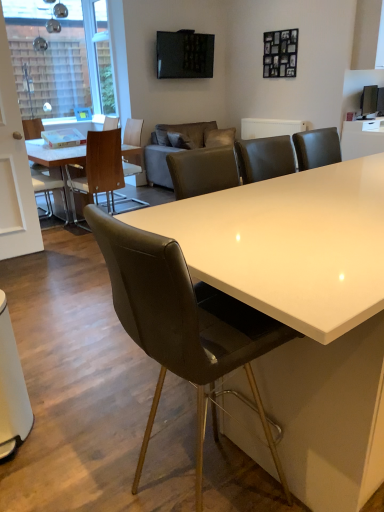
The image size is (384, 512). I want to click on free space on the front side of white leather chair at left, arranged as the 2th chair when viewed from the back, so 58,231.